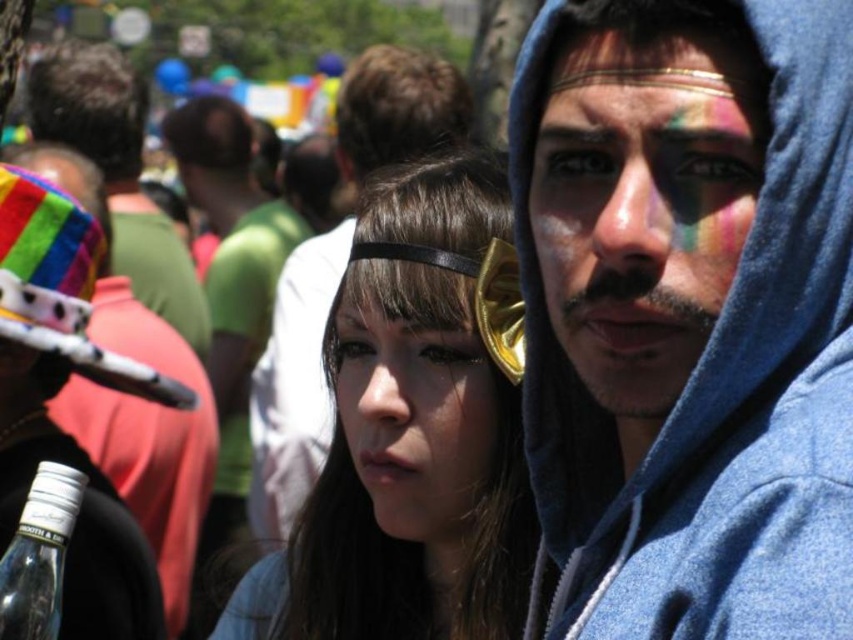
You are a photographer at the event and want to capture both the rainbow fabric headdress at upper left and the clear glass bottle at lower left in a single frame. Given their heights, which object should you focus on first to ensure both are in the frame?

The rainbow fabric headdress at upper left is taller than the clear glass bottle at lower left. To include both in the frame, focus on the rainbow fabric headdress at upper left first as it requires a wider angle or adjustment to accommodate its greater height.